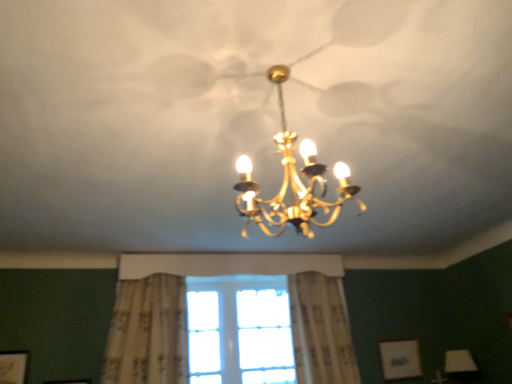
How much space does matte white picture frame at lower right, the 1th picture frame viewed from the back, occupy horizontally?

1.71 inches.

Identify the location of clear glass window at center. (239, 330).

Where is `matte white picture frame at lower left, positioned as the 2th picture frame in right-to-left order`? The width and height of the screenshot is (512, 384). matte white picture frame at lower left, positioned as the 2th picture frame in right-to-left order is located at coordinates (13, 367).

The image size is (512, 384). What are the coordinates of `gold metallic chandelier at center` in the screenshot? It's located at (292, 182).

Considering the relative sizes of floral-patterned fabric curtain at center, which is the second curtain from right to left, and white textured curtain at center, acting as the second curtain starting from the left, in the image provided, is floral-patterned fabric curtain at center, which is the second curtain from right to left, taller than white textured curtain at center, acting as the second curtain starting from the left,?

No.

Does point (136, 363) appear closer or farther from the camera than point (306, 341)?

Point (136, 363) is closer to the camera than point (306, 341).

Is floral-patterned fabric curtain at center, which ranks as the first curtain in left-to-right order, wider than white textured curtain at center, acting as the second curtain starting from the left?

Indeed, floral-patterned fabric curtain at center, which ranks as the first curtain in left-to-right order, has a greater width compared to white textured curtain at center, acting as the second curtain starting from the left.

Does matte white picture frame at lower left, the second picture frame positioned from the back, contain floral-patterned fabric curtain at center, which ranks as the first curtain in left-to-right order?

No, floral-patterned fabric curtain at center, which ranks as the first curtain in left-to-right order, is not inside matte white picture frame at lower left, the second picture frame positioned from the back.

From the image's perspective, is matte white picture frame at lower left, placed as the first picture frame when sorted from left to right, below floral-patterned fabric curtain at center, which ranks as the first curtain in left-to-right order?

Indeed, from the image's perspective, matte white picture frame at lower left, placed as the first picture frame when sorted from left to right, is shown beneath floral-patterned fabric curtain at center, which ranks as the first curtain in left-to-right order.

Starting from the matte white picture frame at lower left, placed as the first picture frame when sorted from left to right, which curtain is the 1st one to the right? Please provide its 2D coordinates.

[(148, 332)]

Does matte white picture frame at lower left, placed as the first picture frame when sorted from left to right, come behind floral-patterned fabric curtain at center, which ranks as the first curtain in left-to-right order?

That is True.

Which is in front, point (415, 354) or point (248, 186)?

The point (248, 186) is in front.

Considering the sizes of matte white picture frame at lower right, placed as the 2th picture frame when sorted from left to right, and gold metallic chandelier at center in the image, is matte white picture frame at lower right, placed as the 2th picture frame when sorted from left to right, bigger or smaller than gold metallic chandelier at center?

matte white picture frame at lower right, placed as the 2th picture frame when sorted from left to right, is smaller than gold metallic chandelier at center.

From the picture: Which is in front, matte white picture frame at lower right, the 1th picture frame viewed from the back, or gold metallic chandelier at center?

Positioned in front is gold metallic chandelier at center.

From the image's perspective, starting from the gold metallic chandelier at center, which curtain is the 1st one below? Please provide its 2D coordinates.

[(148, 332)]

Between gold metallic chandelier at center and floral-patterned fabric curtain at center, which is the second curtain from right to left, which one has smaller size?

gold metallic chandelier at center is smaller.

Is floral-patterned fabric curtain at center, which is the second curtain from right to left, located within gold metallic chandelier at center?

No.

Based on the photo, which is more to the left, clear glass window at center or gold metallic chandelier at center?

clear glass window at center.

Is clear glass window at center outside of gold metallic chandelier at center?

Yes, clear glass window at center is not within gold metallic chandelier at center.

Is clear glass window at center looking in the opposite direction of gold metallic chandelier at center?

No, clear glass window at center's orientation is not away from gold metallic chandelier at center.

Does white textured curtain at center, the 1th curtain viewed from the right, have a greater height compared to matte white picture frame at lower right, placed as the 2th picture frame when sorted from left to right?

Correct, white textured curtain at center, the 1th curtain viewed from the right, is much taller as matte white picture frame at lower right, placed as the 2th picture frame when sorted from left to right.

From a real-world perspective, is white textured curtain at center, acting as the second curtain starting from the left, physically below matte white picture frame at lower right, the 1th picture frame viewed from the back?

Actually, white textured curtain at center, acting as the second curtain starting from the left, is physically above matte white picture frame at lower right, the 1th picture frame viewed from the back, in the real world.

Would you say matte white picture frame at lower right, which appears as the 2th picture frame when viewed from the front, is part of white textured curtain at center, the 1th curtain viewed from the right,'s contents?

No, white textured curtain at center, the 1th curtain viewed from the right, does not contain matte white picture frame at lower right, which appears as the 2th picture frame when viewed from the front.

Between point (340, 367) and point (388, 353), which one is positioned behind?

The point (388, 353) is behind.

From the image's perspective, is matte white picture frame at lower left, the second picture frame positioned from the back, above or below matte white picture frame at lower right, which is counted as the 1th picture frame, starting from the right?

From the image's perspective, matte white picture frame at lower left, the second picture frame positioned from the back, appears above matte white picture frame at lower right, which is counted as the 1th picture frame, starting from the right.

Is matte white picture frame at lower left, placed as the first picture frame when sorted from left to right, looking in the opposite direction of matte white picture frame at lower right, which appears as the 2th picture frame when viewed from the front?

No.

Is matte white picture frame at lower left, placed as the first picture frame when sorted from left to right, placed right next to matte white picture frame at lower right, which is counted as the 1th picture frame, starting from the right?

No.

Which of these two, matte white picture frame at lower left, the first picture frame from the front, or matte white picture frame at lower right, the 1th picture frame viewed from the back, stands taller?

matte white picture frame at lower left, the first picture frame from the front.

Find the location of a particular element. curtain on the left of white textured curtain at center, the 1th curtain viewed from the right is located at coordinates (148, 332).

From the image's perspective, starting from the floral-patterned fabric curtain at center, which ranks as the first curtain in left-to-right order, which picture frame is the 1st one below? Please provide its 2D coordinates.

[(13, 367)]

Looking at the image, which one is located closer to gold metallic chandelier at center, matte white picture frame at lower right, placed as the 2th picture frame when sorted from left to right, or floral-patterned fabric curtain at center, which ranks as the first curtain in left-to-right order?

floral-patterned fabric curtain at center, which ranks as the first curtain in left-to-right order, lies closer to gold metallic chandelier at center than the other object.

From the image, which object appears to be nearer to matte white picture frame at lower right, placed as the 2th picture frame when sorted from left to right, white textured curtain at center, acting as the second curtain starting from the left, or matte white picture frame at lower left, the first picture frame from the front?

The object closer to matte white picture frame at lower right, placed as the 2th picture frame when sorted from left to right, is white textured curtain at center, acting as the second curtain starting from the left.

Looking at the image, which one is located further to matte white picture frame at lower right, the 1th picture frame viewed from the back, floral-patterned fabric curtain at center, which is the second curtain from right to left, or gold metallic chandelier at center?

The object further to matte white picture frame at lower right, the 1th picture frame viewed from the back, is gold metallic chandelier at center.

Which object lies further to the anchor point white textured curtain at center, acting as the second curtain starting from the left, clear glass window at center or gold metallic chandelier at center?

gold metallic chandelier at center.

Based on their spatial positions, is gold metallic chandelier at center or clear glass window at center further from matte white picture frame at lower right, which is counted as the 1th picture frame, starting from the right?

gold metallic chandelier at center lies further to matte white picture frame at lower right, which is counted as the 1th picture frame, starting from the right, than the other object.

Looking at the image, which one is located closer to matte white picture frame at lower left, the first picture frame from the front, clear glass window at center or matte white picture frame at lower right, placed as the 2th picture frame when sorted from left to right?

The object closer to matte white picture frame at lower left, the first picture frame from the front, is clear glass window at center.

From the image, which object appears to be farther from floral-patterned fabric curtain at center, which is the second curtain from right to left, clear glass window at center or matte white picture frame at lower left, the second picture frame positioned from the back?

matte white picture frame at lower left, the second picture frame positioned from the back, is further to floral-patterned fabric curtain at center, which is the second curtain from right to left.

Estimate the real-world distances between objects in this image. Which object is closer to matte white picture frame at lower left, positioned as the 2th picture frame in right-to-left order, gold metallic chandelier at center or white textured curtain at center, acting as the second curtain starting from the left?

white textured curtain at center, acting as the second curtain starting from the left, is positioned closer to the anchor matte white picture frame at lower left, positioned as the 2th picture frame in right-to-left order.

Find the location of a particular element. The image size is (512, 384). lamp between matte white picture frame at lower left, positioned as the 2th picture frame in right-to-left order, and white textured curtain at center, the 1th curtain viewed from the right is located at coordinates (292, 182).

In order to click on window between matte white picture frame at lower left, positioned as the 2th picture frame in right-to-left order, and white textured curtain at center, acting as the second curtain starting from the left, from left to right in this screenshot , I will do click(239, 330).

Where is `lamp between matte white picture frame at lower left, the second picture frame positioned from the back, and matte white picture frame at lower right, which is counted as the 1th picture frame, starting from the right, from left to right`? lamp between matte white picture frame at lower left, the second picture frame positioned from the back, and matte white picture frame at lower right, which is counted as the 1th picture frame, starting from the right, from left to right is located at coordinates (292, 182).

Locate an element on the screen. The image size is (512, 384). curtain between gold metallic chandelier at center and matte white picture frame at lower left, the first picture frame from the front, in the front-back direction is located at coordinates (148, 332).